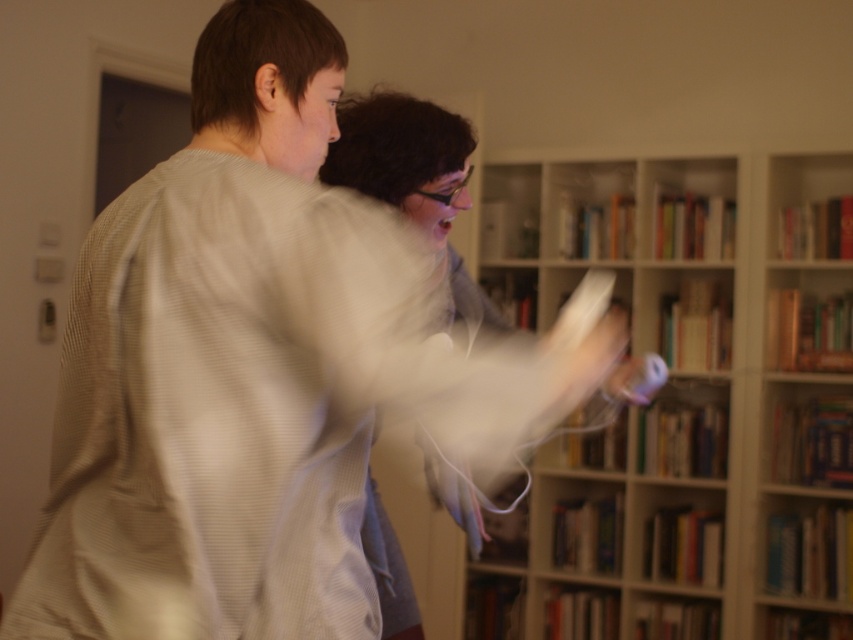
Question: Does wooden bookshelf at center have a greater width compared to white matte controller at center?

Choices:
 (A) no
 (B) yes

Answer: (B)

Question: Which of the following is the farthest from the observer?

Choices:
 (A) (662, 250)
 (B) (573, 42)

Answer: (B)

Question: Can you confirm if wooden bookshelf at center is positioned below white matte controller at center?

Choices:
 (A) yes
 (B) no

Answer: (A)

Question: Which of the following is the closest to the observer?

Choices:
 (A) (117, 32)
 (B) (838, 340)

Answer: (B)

Question: Can you confirm if wooden bookshelf at center is positioned to the left of white matte controller at center?

Choices:
 (A) no
 (B) yes

Answer: (A)